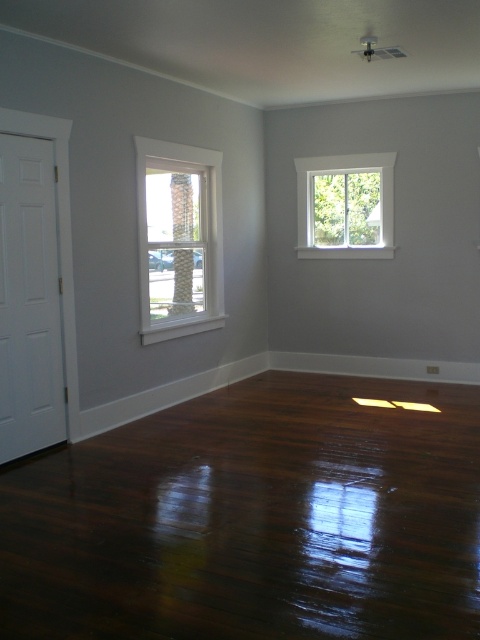
You are planning to install a new air conditioner unit that requires a 3x3 feet opening. Based on the scene, which window between the white wood window at left and the white glass window at upper right is more suitable for installation?

The white wood window at left is larger in size than the white glass window at upper right, so it is more suitable for installing the air conditioner unit requiring a 3x3 feet opening.

You are standing in the room and want to place a large rug on the floor. Considering the size of the shiny dark wood floor at lower center and the white wood window at left, which object would be more suitable for placing the rug under?

The shiny dark wood floor at lower center is larger in size than the white wood window at left, so the rug should be placed under the shiny dark wood floor at lower center since it has enough space.

You are standing in the room and see two points marked on the wall. The first point is at coordinates point [146,173] and the second is at point [355,164]. If you are facing the wall where these points are located, which point is closer to you?

Point [146,173] is in front of point [355,164], so it is closer to you.